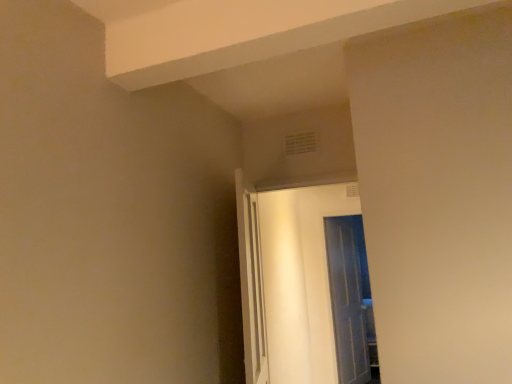
Question: In terms of height, does clear glass door at center, acting as the 1th door starting from the right, look taller or shorter compared to white glossy door at center, which is the second door from back to front?

Choices:
 (A) tall
 (B) short

Answer: (A)

Question: Is clear glass door at center, positioned as the 1th door in back-to-front order, in front of or behind white glossy door at center, which is the 1th door in front-to-back order, in the image?

Choices:
 (A) behind
 (B) front

Answer: (A)

Question: Choose the correct answer: Is clear glass door at center, acting as the 1th door starting from the right, inside white glossy door at center, the 2th door from the right, or outside it?

Choices:
 (A) inside
 (B) outside

Answer: (B)

Question: From a real-world perspective, is white glossy door at center, which is counted as the first door, starting from the left, positioned above or below clear glass door at center, placed as the 2th door when sorted from left to right?

Choices:
 (A) above
 (B) below

Answer: (A)

Question: In terms of width, does white glossy door at center, the 2th door from the right, look wider or thinner when compared to clear glass door at center, acting as the 1th door starting from the right?

Choices:
 (A) thin
 (B) wide

Answer: (B)

Question: From their relative heights in the image, would you say white glossy door at center, which is the second door from back to front, is taller or shorter than clear glass door at center, placed as the 2th door when sorted from left to right?

Choices:
 (A) short
 (B) tall

Answer: (A)

Question: Considering the positions of point (346, 188) and point (332, 261), is point (346, 188) closer or farther from the camera than point (332, 261)?

Choices:
 (A) farther
 (B) closer

Answer: (A)